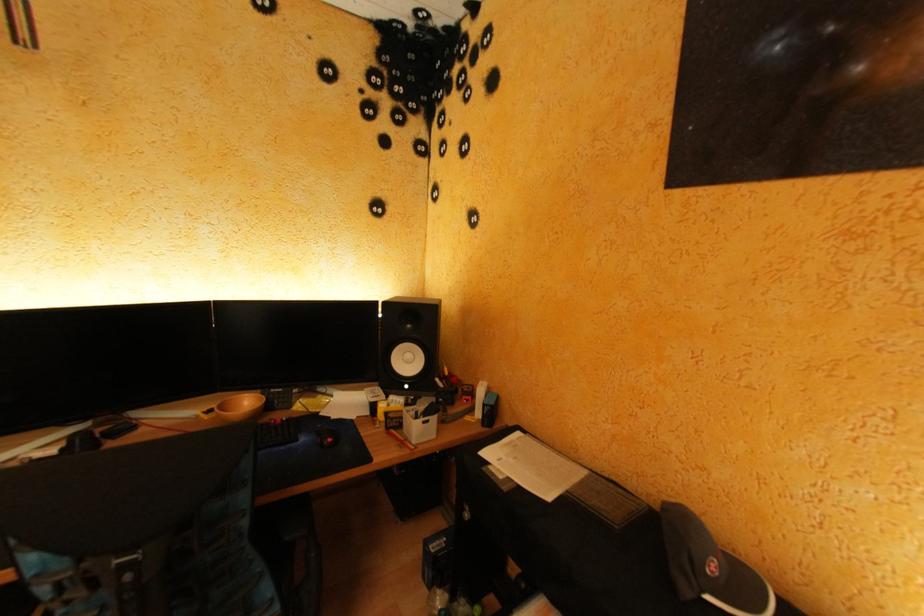
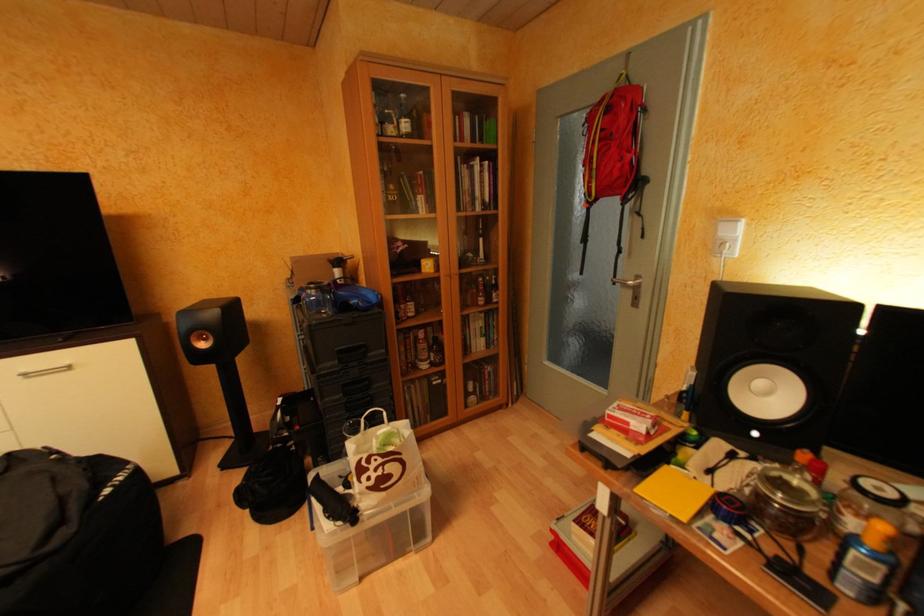
Question: Based on the continuous images, in which direction is the camera rotating? Reply with the corresponding letter.

Choices:
 (A) Left
 (B) Right
 (C) Up
 (D) Down

Answer: (A)